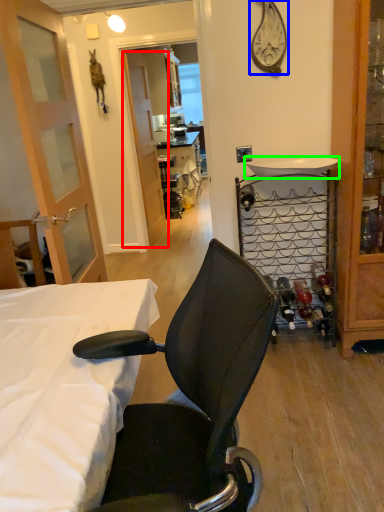
Question: Which object is the closest to the screen door (highlighted by a red box)? Choose among these: clock (highlighted by a blue box) or sink (highlighted by a green box).

Choices:
 (A) clock
 (B) sink

Answer: (B)